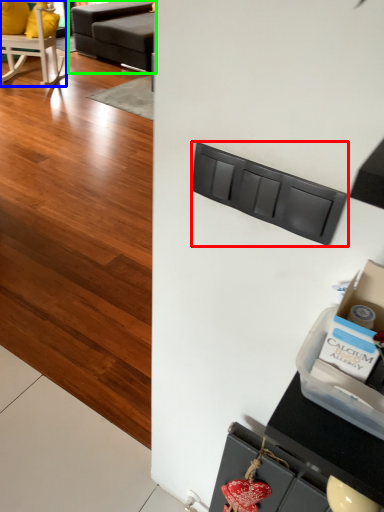
Question: Based on their relative distances, which object is farther from drawer (highlighted by a red box)? Choose from chair (highlighted by a blue box) and studio couch (highlighted by a green box).

Choices:
 (A) chair
 (B) studio couch

Answer: (B)